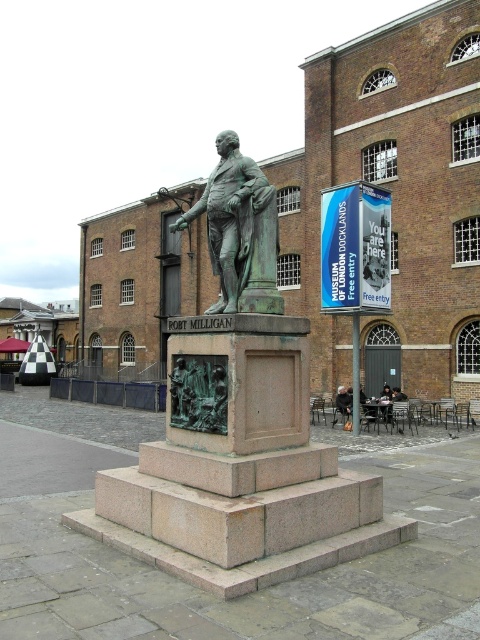
Is bronze statue at center smaller than dark brown leather jacket at lower center?

No, bronze statue at center is not smaller than dark brown leather jacket at lower center.

Can you confirm if bronze statue at center is positioned above dark brown leather jacket at lower center?

Yes, bronze statue at center is above dark brown leather jacket at lower center.

Is point (218, 220) farther from viewer compared to point (336, 397)?

No, it is in front of (336, 397).

The height and width of the screenshot is (640, 480). Identify the location of bronze statue at center. click(240, 230).